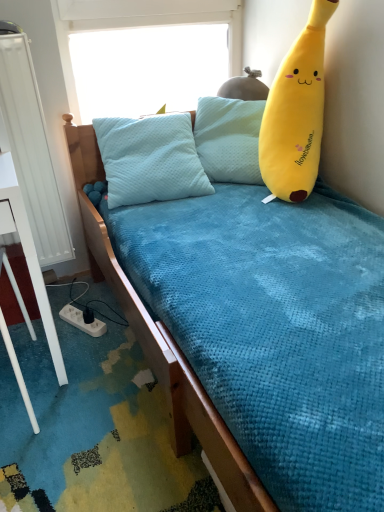
Question: Is white plastic power outlet at lower left with white metallic radiator at left?

Choices:
 (A) no
 (B) yes

Answer: (A)

Question: From the image's perspective, is white plastic power outlet at lower left located above white metallic radiator at left?

Choices:
 (A) yes
 (B) no

Answer: (B)

Question: Is white plastic power outlet at lower left further to camera compared to white metallic radiator at left?

Choices:
 (A) yes
 (B) no

Answer: (A)

Question: Does white plastic power outlet at lower left appear on the right side of white metallic radiator at left?

Choices:
 (A) yes
 (B) no

Answer: (A)

Question: Can you confirm if white plastic power outlet at lower left is taller than white metallic radiator at left?

Choices:
 (A) no
 (B) yes

Answer: (A)

Question: Is white plastic power outlet at lower left not within white metallic radiator at left?

Choices:
 (A) yes
 (B) no

Answer: (A)

Question: Is transparent plastic window screen at upper center bigger than white metallic radiator at left?

Choices:
 (A) no
 (B) yes

Answer: (B)

Question: From the image's perspective, does transparent plastic window screen at upper center appear lower than white metallic radiator at left?

Choices:
 (A) yes
 (B) no

Answer: (B)

Question: Is transparent plastic window screen at upper center to the right of white metallic radiator at left from the viewer's perspective?

Choices:
 (A) no
 (B) yes

Answer: (B)

Question: Does transparent plastic window screen at upper center have a lesser height compared to white metallic radiator at left?

Choices:
 (A) no
 (B) yes

Answer: (B)

Question: Could you tell me if transparent plastic window screen at upper center is facing white metallic radiator at left?

Choices:
 (A) yes
 (B) no

Answer: (B)

Question: From the image's perspective, is transparent plastic window screen at upper center above white metallic radiator at left?

Choices:
 (A) no
 (B) yes

Answer: (B)

Question: Is transparent plastic window screen at upper center to the right of white plastic power outlet at lower left from the viewer's perspective?

Choices:
 (A) no
 (B) yes

Answer: (B)